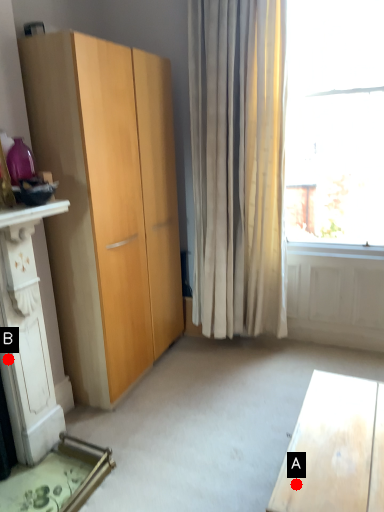
Question: Two points are circled on the image, labeled by A and B beside each circle. Which point is closer to the camera?

Choices:
 (A) A is closer
 (B) B is closer

Answer: (A)